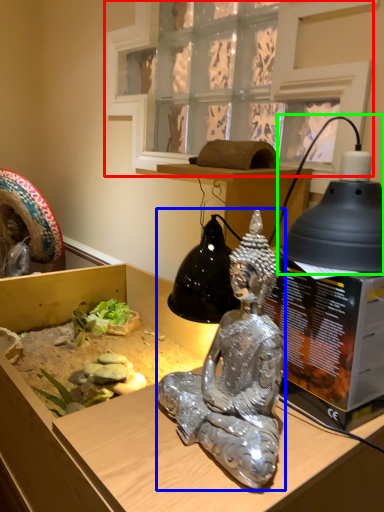
Question: Based on their relative distances, which object is nearer to window (highlighted by a red box)? Choose from person (highlighted by a blue box) and lamp (highlighted by a green box).

Choices:
 (A) person
 (B) lamp

Answer: (B)